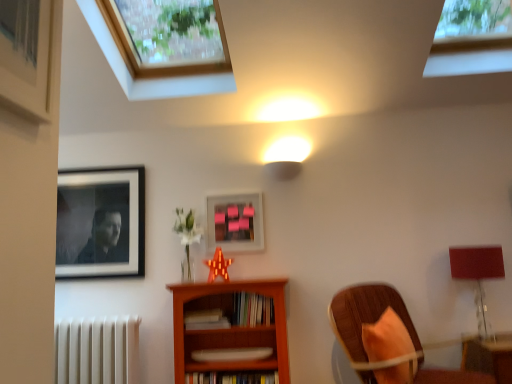
Question: Is white matte radiator at lower left facing towards wooden bookcase at center?

Choices:
 (A) no
 (B) yes

Answer: (A)

Question: Considering the relative sizes of white matte radiator at lower left and wooden bookcase at center in the image provided, is white matte radiator at lower left shorter than wooden bookcase at center?

Choices:
 (A) no
 (B) yes

Answer: (B)

Question: From the image's perspective, would you say white matte radiator at lower left is positioned over wooden bookcase at center?

Choices:
 (A) no
 (B) yes

Answer: (A)

Question: Is white matte radiator at lower left not inside wooden bookcase at center?

Choices:
 (A) no
 (B) yes

Answer: (B)

Question: Is white matte radiator at lower left turned away from wooden bookcase at center?

Choices:
 (A) no
 (B) yes

Answer: (A)

Question: Visually, is wooden chair with orange cushion at lower right positioned to the left or to the right of white matte radiator at lower left?

Choices:
 (A) left
 (B) right

Answer: (B)

Question: Considering the positions of point (379, 367) and point (97, 365), is point (379, 367) closer or farther from the camera than point (97, 365)?

Choices:
 (A) farther
 (B) closer

Answer: (B)

Question: From a real-world perspective, is wooden chair with orange cushion at lower right above or below white matte radiator at lower left?

Choices:
 (A) above
 (B) below

Answer: (A)

Question: Is wooden chair with orange cushion at lower right inside or outside of white matte radiator at lower left?

Choices:
 (A) outside
 (B) inside

Answer: (A)

Question: In the image, is white matte radiator at lower left positioned in front of or behind matte red table lamp at right?

Choices:
 (A) front
 (B) behind

Answer: (B)

Question: From a real-world perspective, is white matte radiator at lower left above or below matte red table lamp at right?

Choices:
 (A) above
 (B) below

Answer: (B)

Question: Looking at the image, does white matte radiator at lower left seem bigger or smaller compared to matte red table lamp at right?

Choices:
 (A) big
 (B) small

Answer: (A)

Question: Is point (124, 342) closer or farther from the camera than point (496, 269)?

Choices:
 (A) closer
 (B) farther

Answer: (B)

Question: Is hardcover books at center, positioned as the third book in bottom-to-top order, to the left or to the right of pink matte picture frame at center, placed as the second picture frame when sorted from left to right, in the image?

Choices:
 (A) left
 (B) right

Answer: (B)

Question: Is point (242, 324) closer or farther from the camera than point (219, 226)?

Choices:
 (A) closer
 (B) farther

Answer: (A)